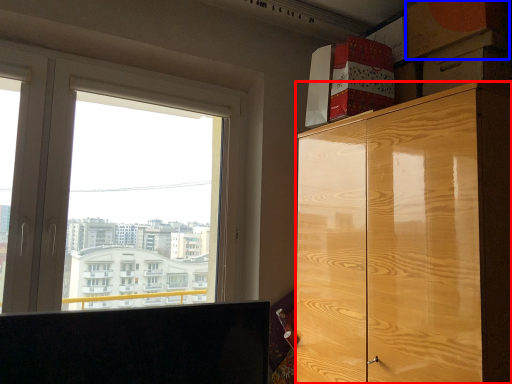
Question: Among these objects, which one is farthest to the camera, cabinetry (highlighted by a red box) or cardboard box (highlighted by a blue box)?

Choices:
 (A) cabinetry
 (B) cardboard box

Answer: (B)